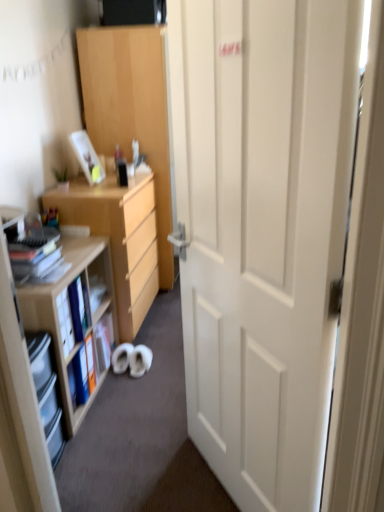
Identify the location of vacant location behind green matte plant at upper left. (70, 187).